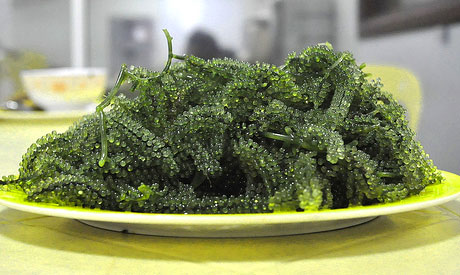
Find the location of `yellow table top`. yellow table top is located at coordinates (53, 251).